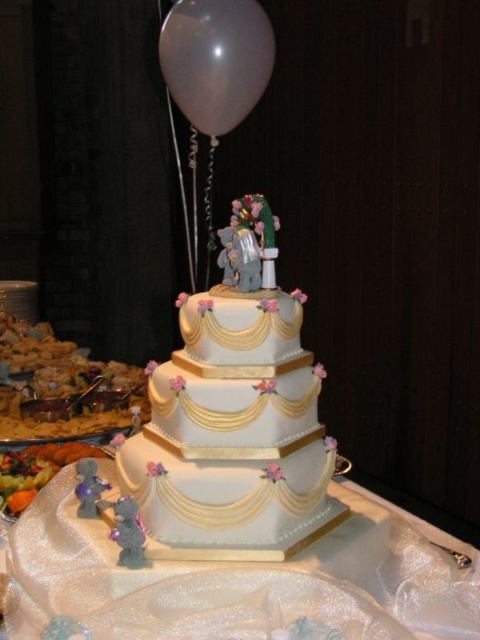
You are a guest at the wedding and want to take a photo with the cake. You notice the white fondant cake at center and the white matte balloon at upper center. Which object is taller?

The white fondant cake at center is taller than the white matte balloon at upper center.

You are a party planner who needs to ensure the white matte balloon at upper center won a safety distance of at least 1 meter from the white fondant cake at center to prevent any accidental contact. Based on the image, is the current distance sufficient?

The distance between the white fondant cake at center and the white matte balloon at upper center is 99.19 centimeters, which is slightly less than the required 1 meter. Therefore, the safety distance is not sufficient, and the balloon should be moved further away to ensure it doesn not accidentally touch the cake.

You are a guest at the wedding and want to take a photo of the cake. You notice two points on the cake where you can place your phone to take a selfie. The first point is at coordinate point(300, 435) and the second is at point(399, 550). Which point is closer to you when standing in front of the cake?

Point(300, 435) is closer to you because it is in front of point(399, 550).